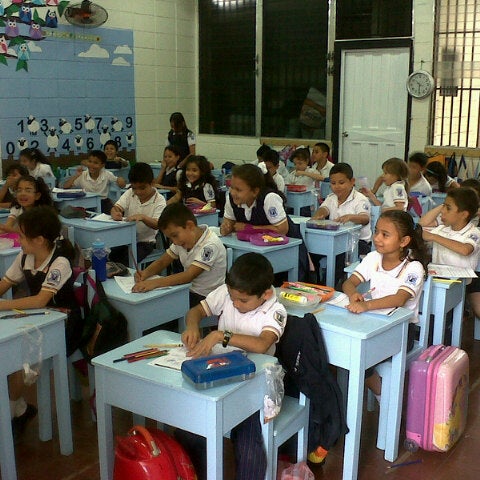
Where is `clock on the wall`? The image size is (480, 480). clock on the wall is located at coordinates (426, 81).